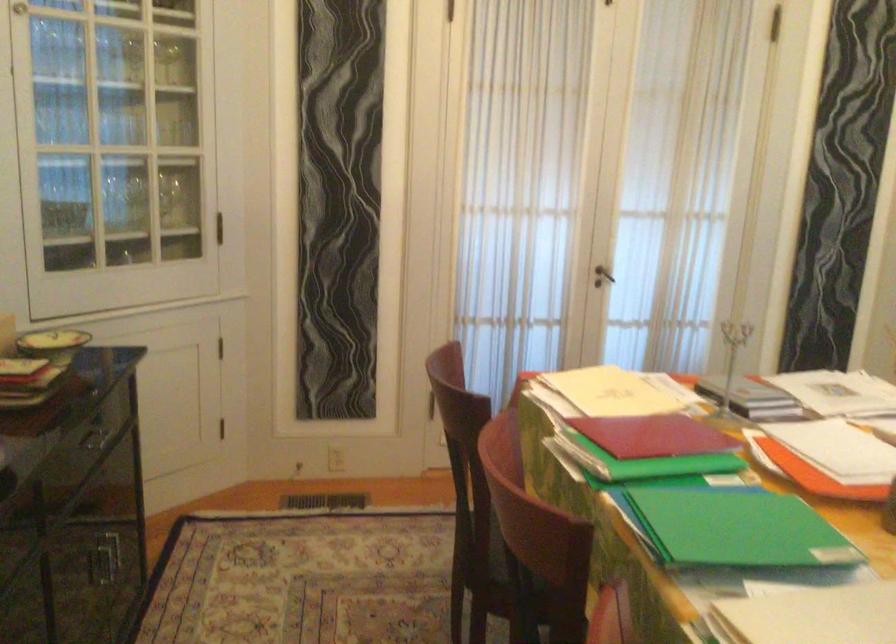
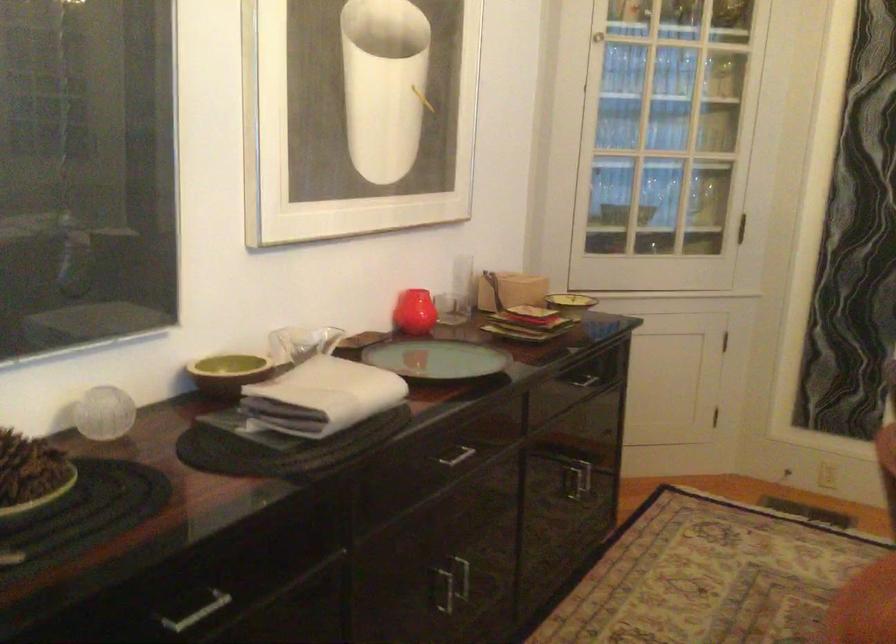
Question: I am providing you with two images of the same scene from different viewpoints. Which of the following objects are not visible in image2?

Choices:
 (A) dark cabinet handle
 (B) red glass vase
 (C) brown ceramic bowl
 (D) none of these

Answer: (D)